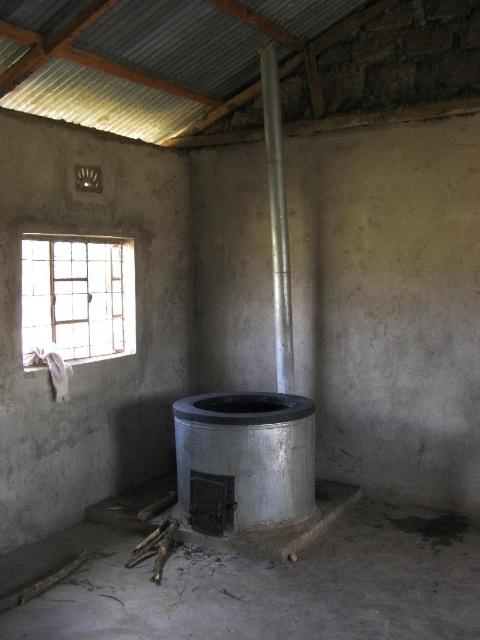
Question: Is clear glass window at upper left positioned behind silver metallic chimney at center?

Choices:
 (A) no
 (B) yes

Answer: (A)

Question: Which point is closer to the camera taking this photo?

Choices:
 (A) (267, 65)
 (B) (109, 296)

Answer: (A)

Question: In this image, where is clear glass window at upper left located relative to silver metallic chimney at center?

Choices:
 (A) right
 (B) left

Answer: (B)

Question: Is clear glass window at upper left in front of silver metallic chimney at center?

Choices:
 (A) yes
 (B) no

Answer: (A)